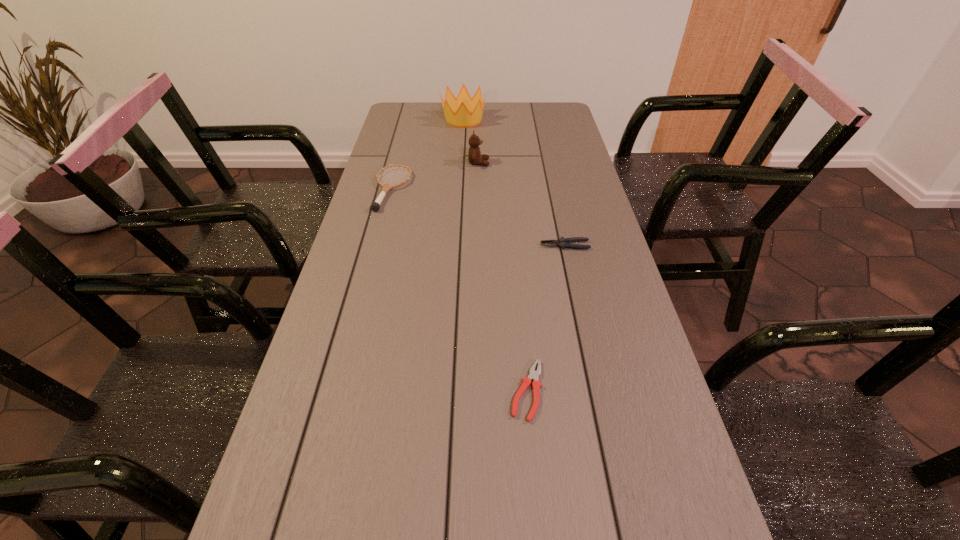
Where is `free spot at the far left corner of the desktop`? free spot at the far left corner of the desktop is located at coordinates (418, 122).

I want to click on vacant space at the far right corner of the desktop, so 550,123.

Where is `vacant area that lies between the teddy bear and the third tallest object`? The height and width of the screenshot is (540, 960). vacant area that lies between the teddy bear and the third tallest object is located at coordinates (435, 176).

Find the location of a particular element. This screenshot has width=960, height=540. free spot between the crown and the tennis racket is located at coordinates (428, 154).

Locate an element on the screen. The height and width of the screenshot is (540, 960). vacant area that lies between the tennis racket and the teddy bear is located at coordinates (435, 176).

Find the location of a particular element. The width and height of the screenshot is (960, 540). vacant area between the taller pliers and the leftmost object is located at coordinates (478, 217).

This screenshot has height=540, width=960. I want to click on free point between the crown and the second shortest object, so click(515, 183).

At what (x,y) coordinates should I click in order to perform the action: click on vacant space that's between the leftmost object and the taller pliers. Please return your answer as a coordinate pair (x, y). Looking at the image, I should click on (478, 217).

You are a GUI agent. You are given a task and a screenshot of the screen. Output one action in this format:
    pyautogui.click(x=<x>, y=<y>)
    Task: Click on the free point between the shortest object and the farthest object
    The width and height of the screenshot is (960, 540).
    Given the screenshot: What is the action you would take?
    pyautogui.click(x=495, y=255)

The width and height of the screenshot is (960, 540). I want to click on object that is the third nearest to the teddy bear, so click(563, 242).